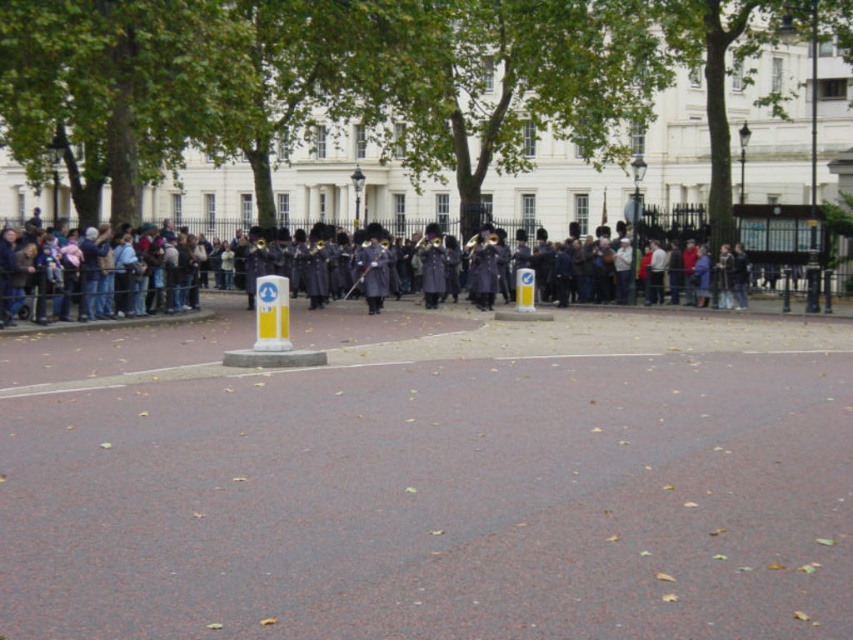
Is point (537, 64) closer to camera compared to point (227, 282)?

Yes, point (537, 64) is in front of point (227, 282).

Which is behind, point (566, 33) or point (648, 240)?

The point (566, 33) is more distant.

The width and height of the screenshot is (853, 640). Identify the location of white glossy building at center. (405, 100).